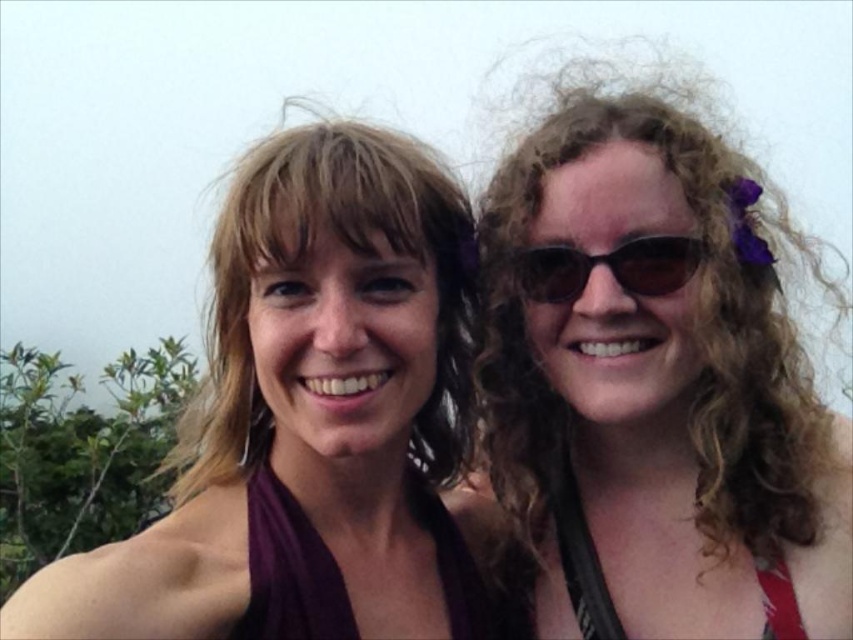
Question: Which point appears closest to the camera in this image?

Choices:
 (A) [254, 401]
 (B) [471, 621]
 (C) [572, 545]

Answer: (B)

Question: Is curly hair at center below blondehair at center?

Choices:
 (A) no
 (B) yes

Answer: (A)

Question: Which point is farther to the camera?

Choices:
 (A) curly hair at center
 (B) matte purple dress at center

Answer: (A)

Question: Can you confirm if matte purple dress at center is thinner than red fabric bikini top at right?

Choices:
 (A) yes
 (B) no

Answer: (B)

Question: Estimate the real-world distances between objects in this image. Which object is farther from the matte purple dress at center?

Choices:
 (A) purple satin bikini top at center
 (B) black plastic sunglasses at right
 (C) blondehair at center
 (D) curly hair at center

Answer: (B)

Question: Can you confirm if purple satin bikini top at center is positioned to the left of red fabric bikini top at right?

Choices:
 (A) yes
 (B) no

Answer: (A)